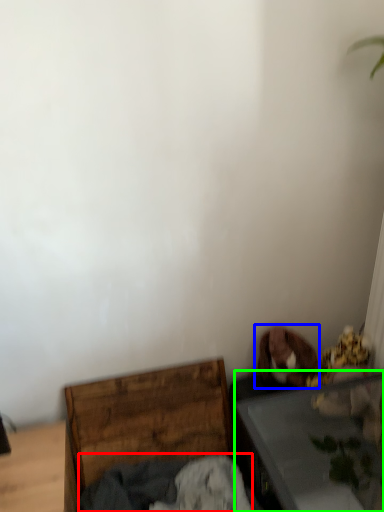
Question: Which object is positioned closest to clothing (highlighted by a red box)? Select from dog (highlighted by a blue box) and table (highlighted by a green box).

Choices:
 (A) dog
 (B) table

Answer: (B)